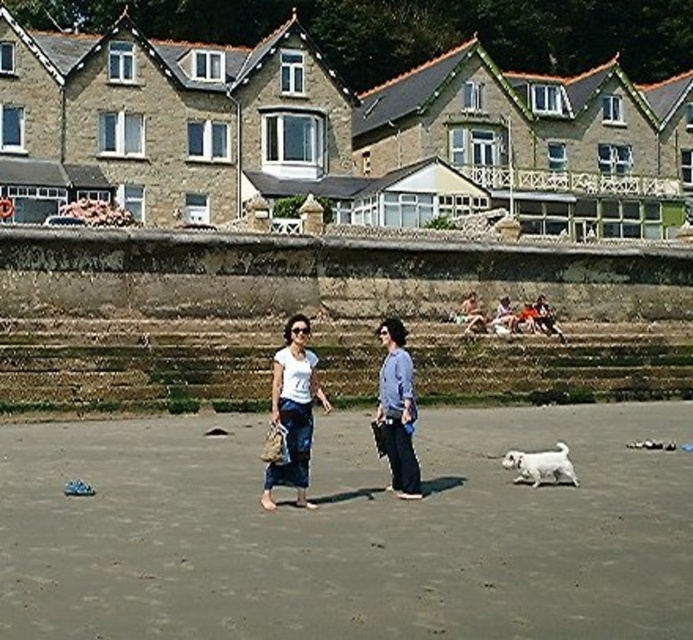
Is blue denim jeans at center to the right of white fluffy dog at lower right from the viewer's perspective?

No, blue denim jeans at center is not to the right of white fluffy dog at lower right.

Can you confirm if blue denim jeans at center is bigger than white fluffy dog at lower right?

Yes.

Locate an element on the screen. The height and width of the screenshot is (640, 693). blue denim jeans at center is located at coordinates (396, 410).

Describe the element at coordinates (349, 531) in the screenshot. I see `gray sand at center` at that location.

The width and height of the screenshot is (693, 640). What do you see at coordinates (349, 531) in the screenshot?
I see `gray sand at center` at bounding box center [349, 531].

The image size is (693, 640). I want to click on gray sand at center, so click(349, 531).

Measure the distance between point (x=301, y=436) and camera.

Point (x=301, y=436) is 93.85 feet away from camera.

Can you confirm if white cotton shirt at center is positioned above white fluffy dog at lower right?

Correct, white cotton shirt at center is located above white fluffy dog at lower right.

Image resolution: width=693 pixels, height=640 pixels. In order to click on white cotton shirt at center in this screenshot , I will do `click(292, 410)`.